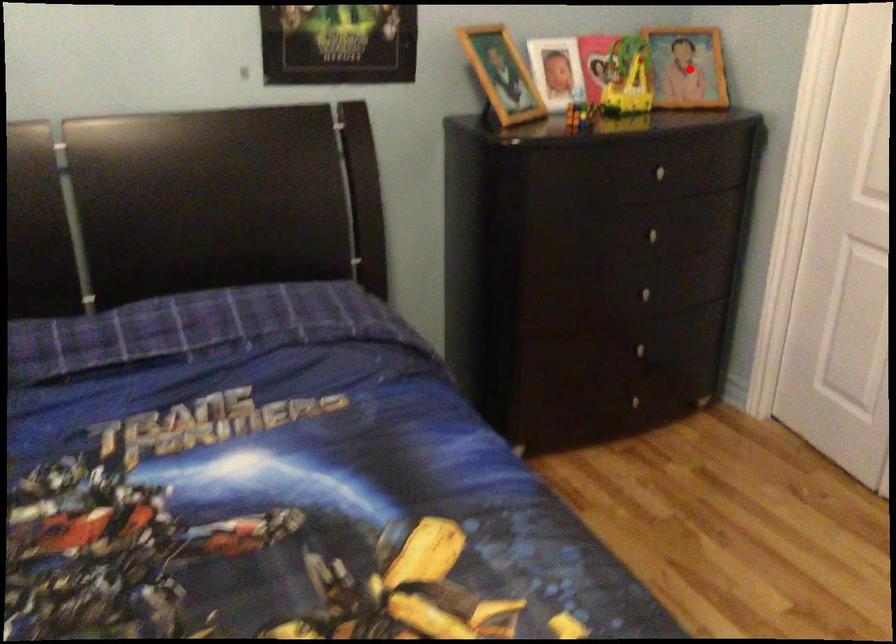
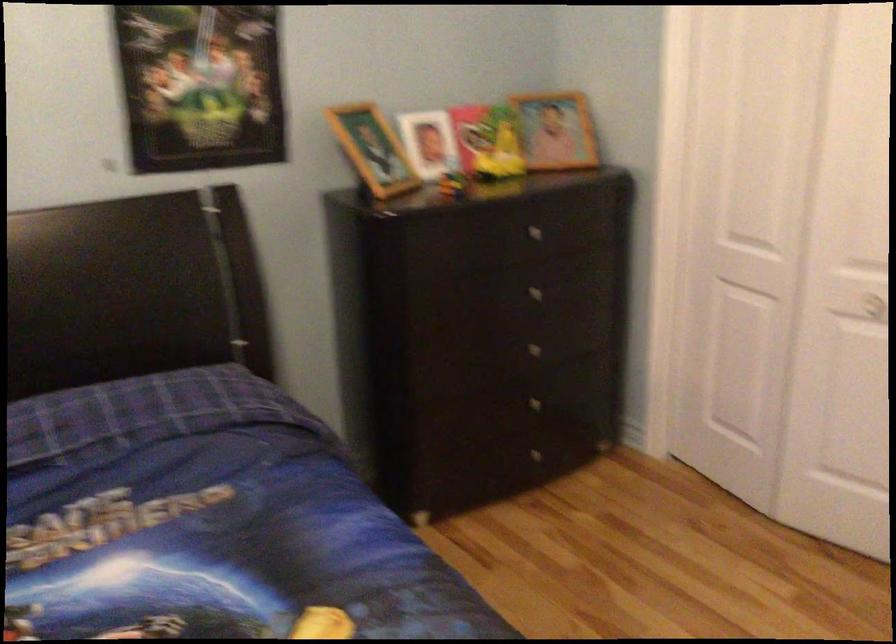
Locate, in the second image, the point that corresponds to the highlighted location in the first image.

(556, 129)